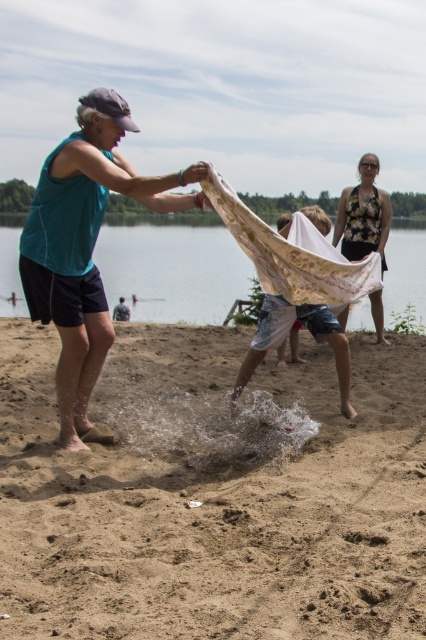
You are a photographer trying to capture the scene of the brown sandy beach at center and the teal fabric at center. Based on their positions, which object should you focus on first to ensure both are in frame?

The brown sandy beach at center is positioned under the teal fabric at center, so you should focus on the teal fabric at center first to ensure both are in frame.

Looking at this image, you are standing at the lakeside beach and want to move from point A to point B. Point A is at coordinate point (310, 410) and point B is at coordinate point (81, 294). Which point is closer to you?

Point B at coordinate point (81, 294) is closer to you because it is less further than point A at coordinate point (310, 410).

You are standing at the lakeside beach and see two points in the scene. The first point is at coordinates point (420, 586) and the second is at point (264, 326). Which point is closer to you?

Point (420, 586) is closer to the viewer than point (264, 326).